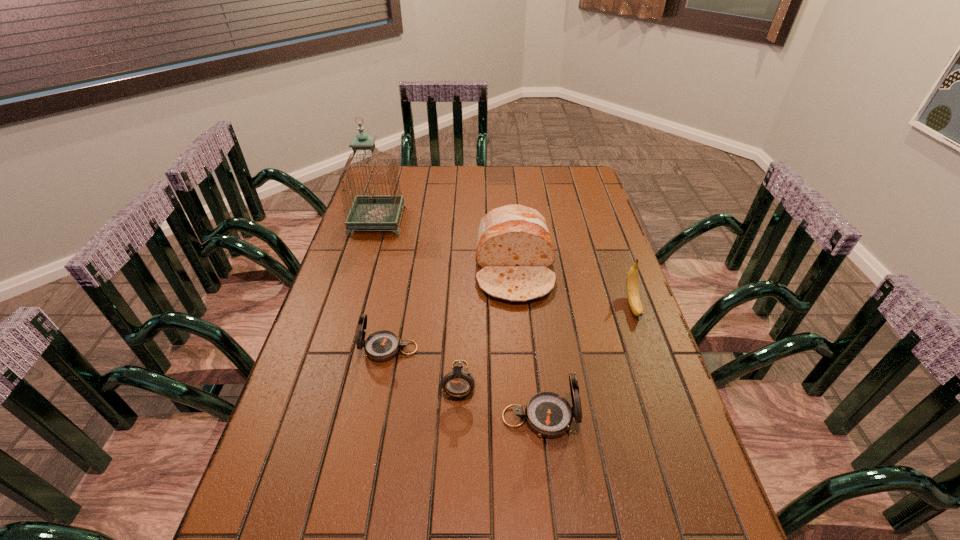
Given the evenly spaced compasss in the image, where should an extra compass be added on the right to preserve the spacing? Please point to a vacant space. Please provide its 2D coordinates. Your answer should be formatted as a tuple, i.e. [(x, y)], where the tuple contains the x and y coordinates of a point satisfying the conditions above.

[(633, 460)]